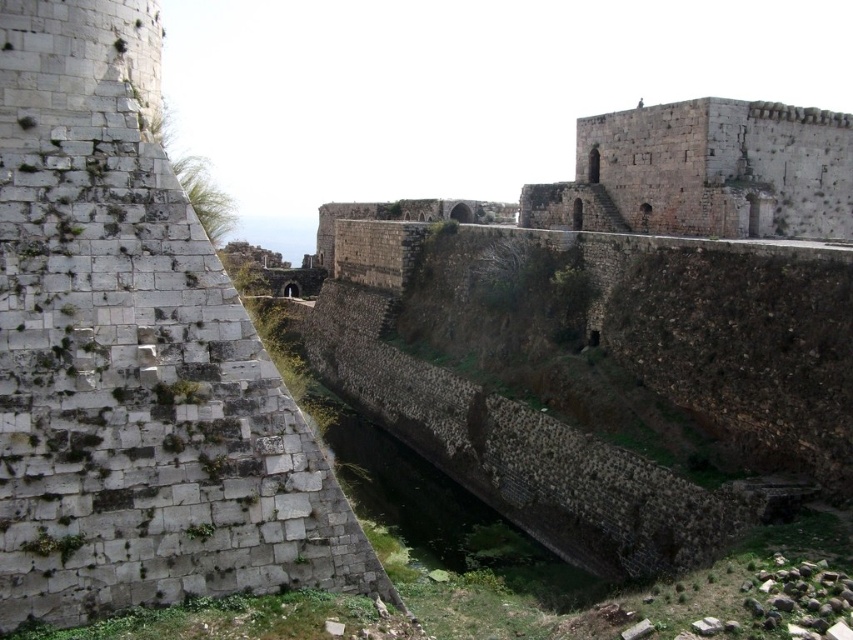
Question: Which point is closer to the camera taking this photo?

Choices:
 (A) (144, 122)
 (B) (717, 209)

Answer: (A)

Question: Can you confirm if white stone wall at left is smaller than gray stone tower at center?

Choices:
 (A) yes
 (B) no

Answer: (A)

Question: Is white stone wall at left wider than gray stone tower at center?

Choices:
 (A) yes
 (B) no

Answer: (B)

Question: Which object is farther from the camera taking this photo?

Choices:
 (A) white stone wall at left
 (B) gray stone tower at center

Answer: (B)

Question: Which point appears farthest from the camera in this image?

Choices:
 (A) (288, 497)
 (B) (614, 212)

Answer: (B)

Question: Considering the relative positions of white stone wall at left and gray stone tower at center in the image provided, where is white stone wall at left located with respect to gray stone tower at center?

Choices:
 (A) left
 (B) right

Answer: (A)